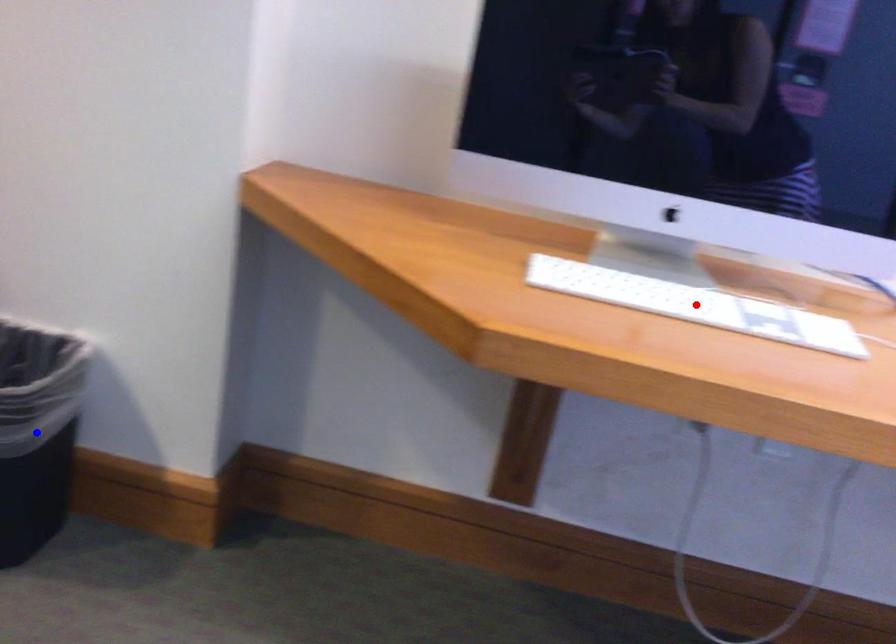
Question: Two points are marked on the image. Which point is closer to the camera?

Choices:
 (A) Blue point is closer.
 (B) Red point is closer.

Answer: (B)